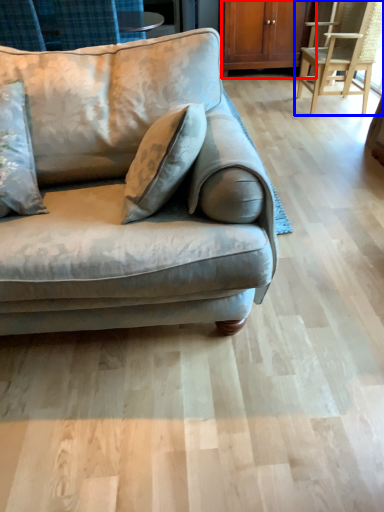
Question: Which object is further to the camera taking this photo, dresser (highlighted by a red box) or chair (highlighted by a blue box)?

Choices:
 (A) dresser
 (B) chair

Answer: (A)